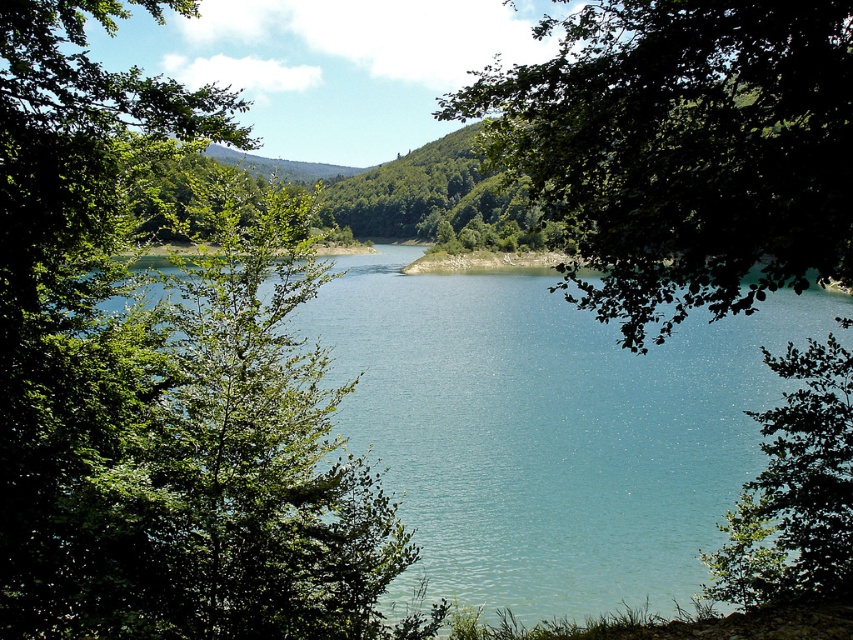
Question: Among these objects, which one is farthest from the camera?

Choices:
 (A) green leafy tree at right
 (B) green leafy tree at left

Answer: (A)

Question: Does green leafy tree at center have a lesser width compared to green leafy tree at right?

Choices:
 (A) yes
 (B) no

Answer: (B)

Question: Which object appears farthest from the camera in this image?

Choices:
 (A) green leafy tree at center
 (B) green leafy tree at left
 (C) clear water at center
 (D) green leafy tree at right

Answer: (C)

Question: Observing the image, what is the correct spatial positioning of green leafy tree at center in reference to green leafy tree at right?

Choices:
 (A) right
 (B) left

Answer: (B)

Question: Which object is the closest to the clear water at center?

Choices:
 (A) green leafy tree at center
 (B) green leafy tree at left
 (C) green leafy tree at right

Answer: (B)

Question: Is green leafy tree at center to the right of green leafy tree at right from the viewer's perspective?

Choices:
 (A) no
 (B) yes

Answer: (A)